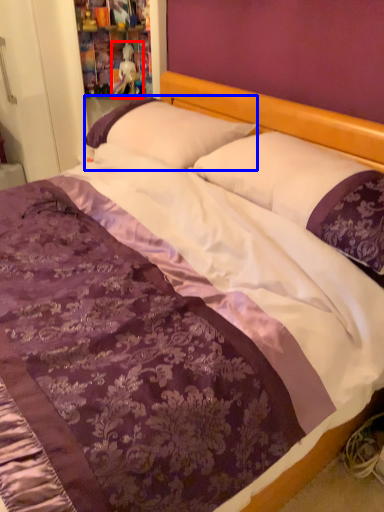
Question: Which object appears closest to the camera in this image, doll (highlighted by a red box) or pillow (highlighted by a blue box)?

Choices:
 (A) doll
 (B) pillow

Answer: (B)